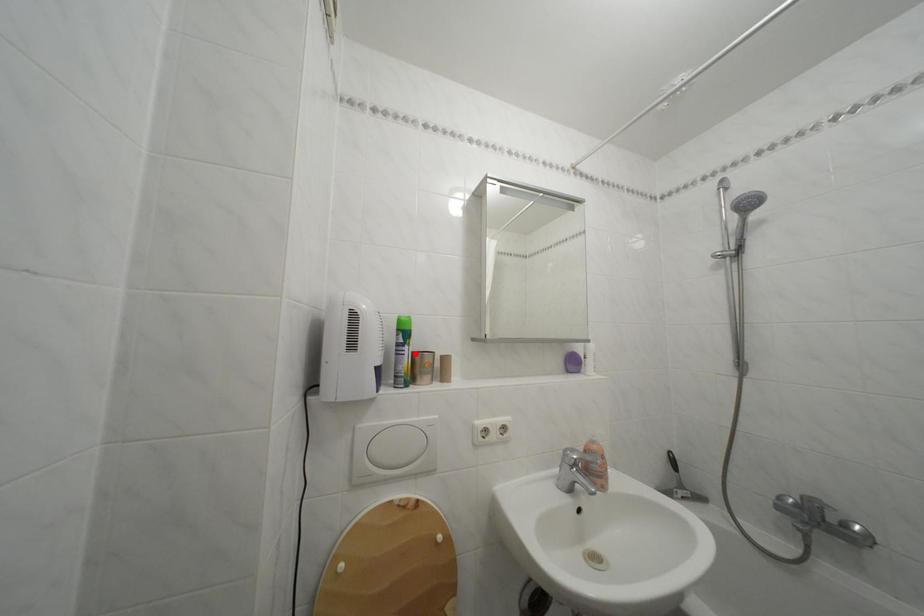
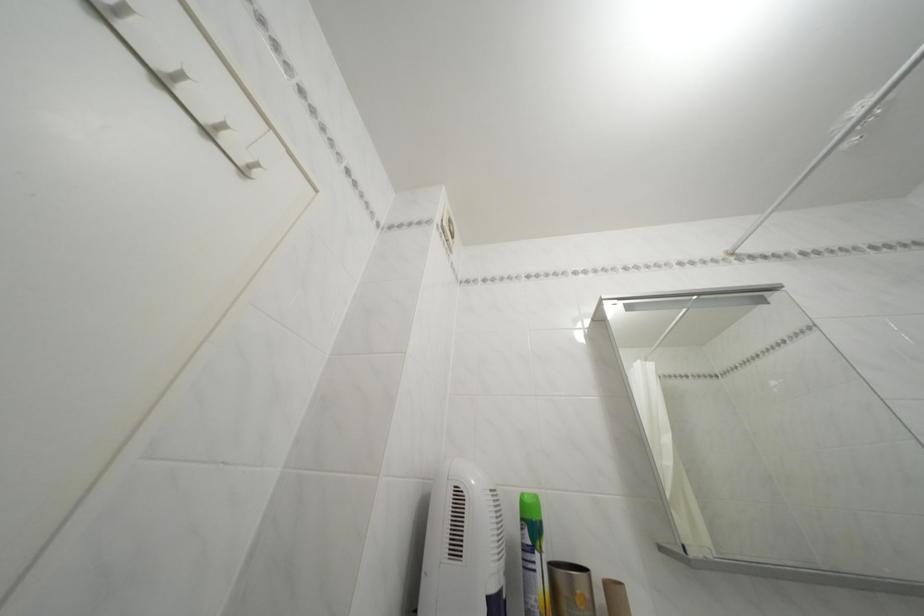
Locate, in the second image, the point that corresponds to the highlighted location in the first image.

(545, 562)